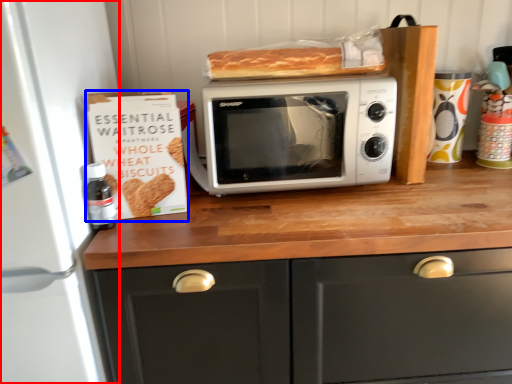
Question: Among these objects, which one is nearest to the camera, appliance (highlighted by a red box) or cardboard box (highlighted by a blue box)?

Choices:
 (A) appliance
 (B) cardboard box

Answer: (A)